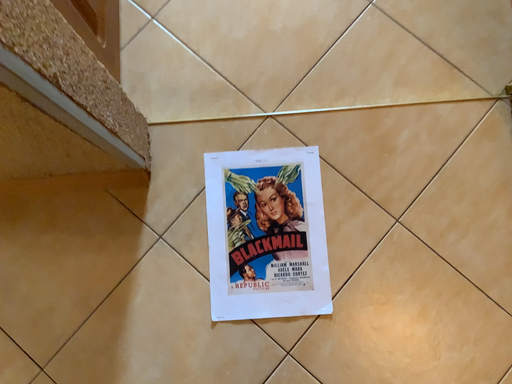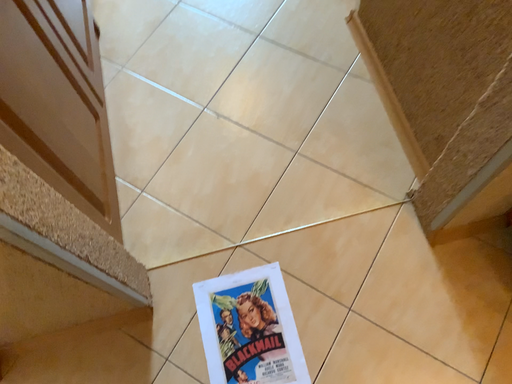
Question: How did the camera likely rotate when shooting the video?

Choices:
 (A) rotated upward
 (B) rotated downward

Answer: (A)